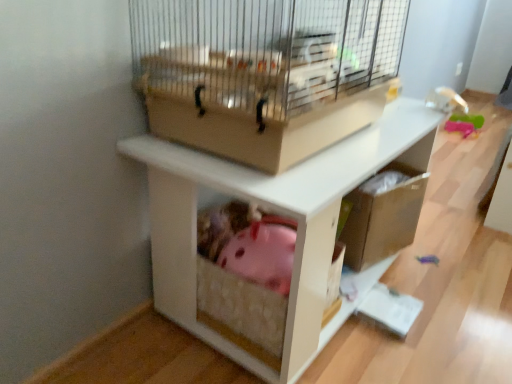
Question: Could you tell me if beige wire mesh bird cage at upper center is facing white matte shelf at center?

Choices:
 (A) yes
 (B) no

Answer: (B)

Question: Is beige wire mesh bird cage at upper center closer to the viewer compared to white matte shelf at center?

Choices:
 (A) no
 (B) yes

Answer: (B)

Question: From the image's perspective, is beige wire mesh bird cage at upper center above white matte shelf at center?

Choices:
 (A) no
 (B) yes

Answer: (B)

Question: Does beige wire mesh bird cage at upper center have a greater height compared to white matte shelf at center?

Choices:
 (A) yes
 (B) no

Answer: (B)

Question: From a real-world perspective, is beige wire mesh bird cage at upper center positioned under white matte shelf at center based on gravity?

Choices:
 (A) yes
 (B) no

Answer: (B)

Question: Is beige wire mesh bird cage at upper center thinner than white matte shelf at center?

Choices:
 (A) yes
 (B) no

Answer: (A)

Question: Does white matte shelf at center appear on the left side of beige wire mesh bird cage at upper center?

Choices:
 (A) no
 (B) yes

Answer: (A)

Question: From the image's perspective, is white matte shelf at center below beige wire mesh bird cage at upper center?

Choices:
 (A) yes
 (B) no

Answer: (A)

Question: Is white matte shelf at center directly adjacent to beige wire mesh bird cage at upper center?

Choices:
 (A) no
 (B) yes

Answer: (A)

Question: Considering the relative sizes of white matte shelf at center and beige wire mesh bird cage at upper center in the image provided, is white matte shelf at center wider than beige wire mesh bird cage at upper center?

Choices:
 (A) no
 (B) yes

Answer: (B)

Question: From a real-world perspective, is white matte shelf at center located beneath beige wire mesh bird cage at upper center?

Choices:
 (A) yes
 (B) no

Answer: (A)

Question: Is white matte shelf at center looking in the opposite direction of beige wire mesh bird cage at upper center?

Choices:
 (A) no
 (B) yes

Answer: (A)

Question: In terms of width, does white matte shelf at center look wider or thinner when compared to beige wire mesh bird cage at upper center?

Choices:
 (A) thin
 (B) wide

Answer: (B)